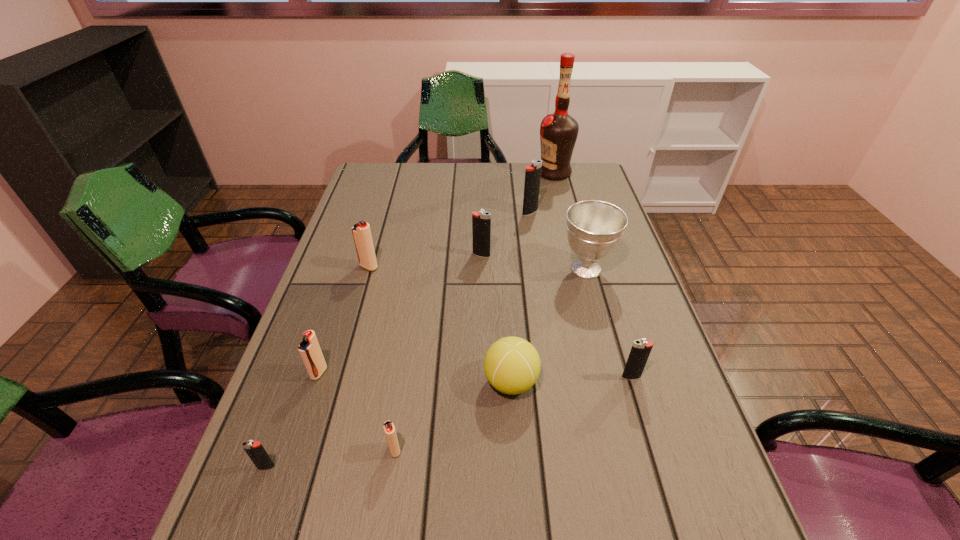
Find the location of a particular element. The image size is (960, 540). free space located on the front and back of the liquor is located at coordinates (509, 173).

Identify the location of vacant area located on the right of the second black igniter from right to left. The width and height of the screenshot is (960, 540). (613, 212).

Find the location of a particular element. The width and height of the screenshot is (960, 540). blank area located 0.400m on the left of the chalice is located at coordinates (412, 269).

Identify the location of vacant area situated 0.200m on the front of the fifth nearest igniter. This screenshot has height=540, width=960. (351, 328).

What are the coordinates of `vacant region located 0.120m on the back of the third black igniter from right to left` in the screenshot? It's located at (481, 227).

I want to click on blank area located on the left of the rightmost black igniter, so click(435, 377).

Identify the location of blank space located on the front of the second object from left to right. This screenshot has height=540, width=960. (279, 493).

The width and height of the screenshot is (960, 540). Find the location of `vacant space positioned 0.170m on the right of the green tennis ball`. vacant space positioned 0.170m on the right of the green tennis ball is located at coordinates (618, 382).

This screenshot has height=540, width=960. In order to click on free space located on the right of the nearest red igniter in this screenshot , I will do `click(562, 450)`.

The width and height of the screenshot is (960, 540). What are the coordinates of `free space located 0.080m on the front of the smallest black igniter` in the screenshot? It's located at (248, 518).